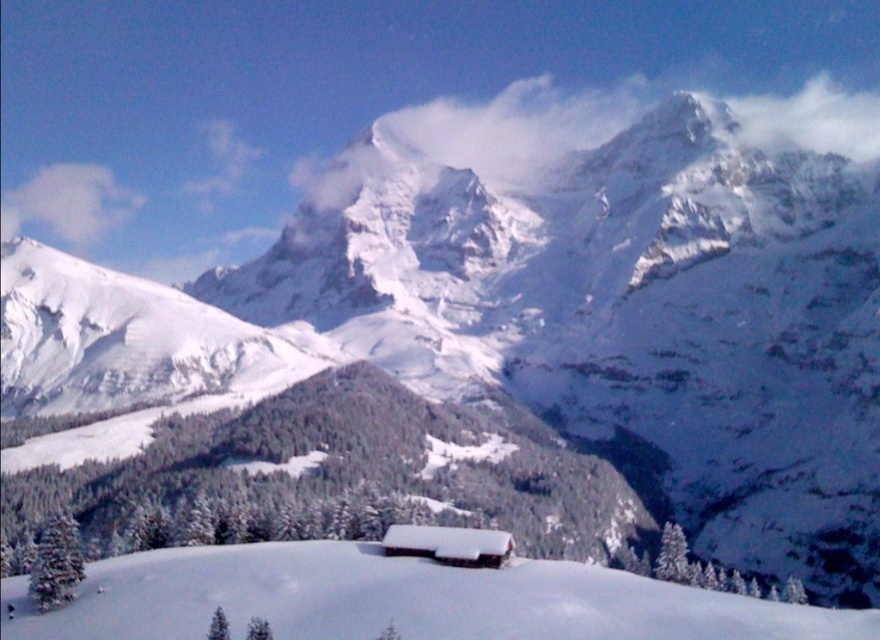
You are planning to build a small cabin on the white snow ski slope at center. Considering the space it occupies compared to the white fluffy cloud at upper left, which one would require more area for construction?

The white fluffy cloud at upper left occupies more space than the white snow ski slope at center, so the cabin would require more area if built on the white fluffy cloud at upper left.

You are an airplane pilot flying over the winter landscape. You need to determine if there is an obstruction between your plane and the white wooden cabin at center. Based on the image, is the white fluffy cloud at upper left blocking your view of the cabin?

The white fluffy cloud at upper left is positioned over the white wooden cabin at center, so yes, the cloud is blocking the view of the cabin.